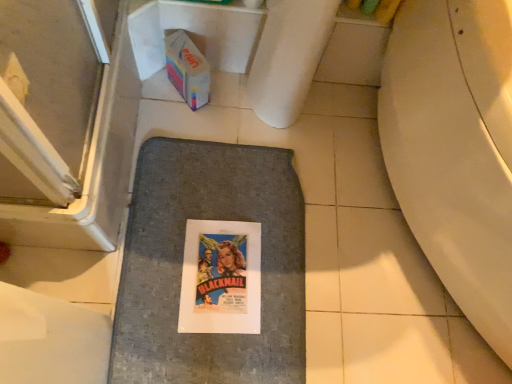
Question: From the image's perspective, is gray fabric bath mat at center above multicolored cardboard box at upper left?

Choices:
 (A) yes
 (B) no

Answer: (B)

Question: Is gray fabric bath mat at center far away from multicolored cardboard box at upper left?

Choices:
 (A) no
 (B) yes

Answer: (A)

Question: From a real-world perspective, is gray fabric bath mat at center physically above multicolored cardboard box at upper left?

Choices:
 (A) yes
 (B) no

Answer: (B)

Question: Is gray fabric bath mat at center wider than multicolored cardboard box at upper left?

Choices:
 (A) no
 (B) yes

Answer: (B)

Question: Is gray fabric bath mat at center oriented towards multicolored cardboard box at upper left?

Choices:
 (A) no
 (B) yes

Answer: (A)

Question: Is the depth of gray fabric bath mat at center less than that of multicolored cardboard box at upper left?

Choices:
 (A) no
 (B) yes

Answer: (B)

Question: Does multicolored cardboard box at upper left have a lesser height compared to gray fabric bath mat at center?

Choices:
 (A) yes
 (B) no

Answer: (B)

Question: From the image's perspective, is multicolored cardboard box at upper left on gray fabric bath mat at center?

Choices:
 (A) no
 (B) yes

Answer: (B)

Question: Is the surface of multicolored cardboard box at upper left in direct contact with gray fabric bath mat at center?

Choices:
 (A) yes
 (B) no

Answer: (B)

Question: From the image's perspective, is multicolored cardboard box at upper left under gray fabric bath mat at center?

Choices:
 (A) yes
 (B) no

Answer: (B)

Question: Does multicolored cardboard box at upper left lie in front of gray fabric bath mat at center?

Choices:
 (A) no
 (B) yes

Answer: (A)

Question: Is multicolored cardboard box at upper left further to camera compared to gray fabric bath mat at center?

Choices:
 (A) yes
 (B) no

Answer: (A)

Question: From their relative heights in the image, would you say gray fabric bath mat at center is taller or shorter than multicolored cardboard box at upper left?

Choices:
 (A) short
 (B) tall

Answer: (A)